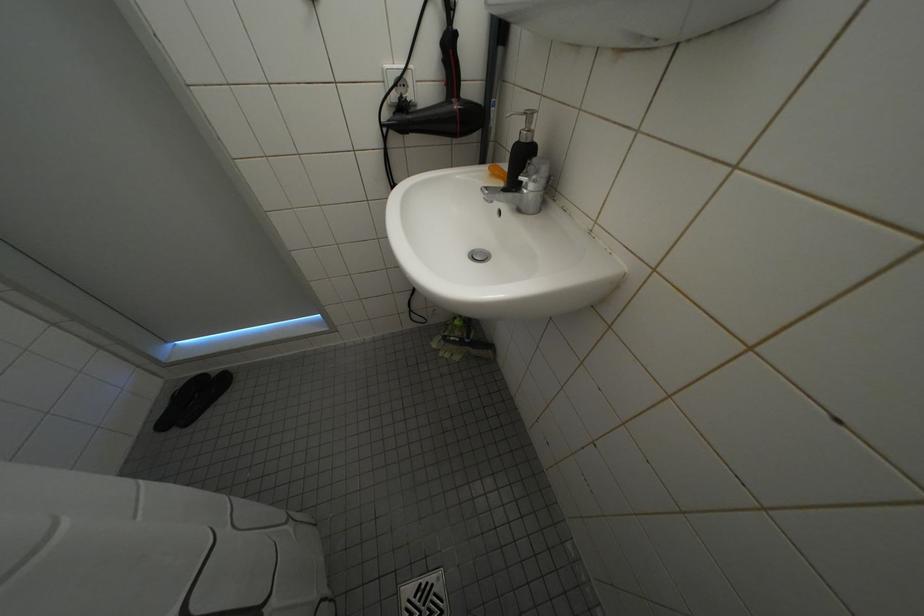
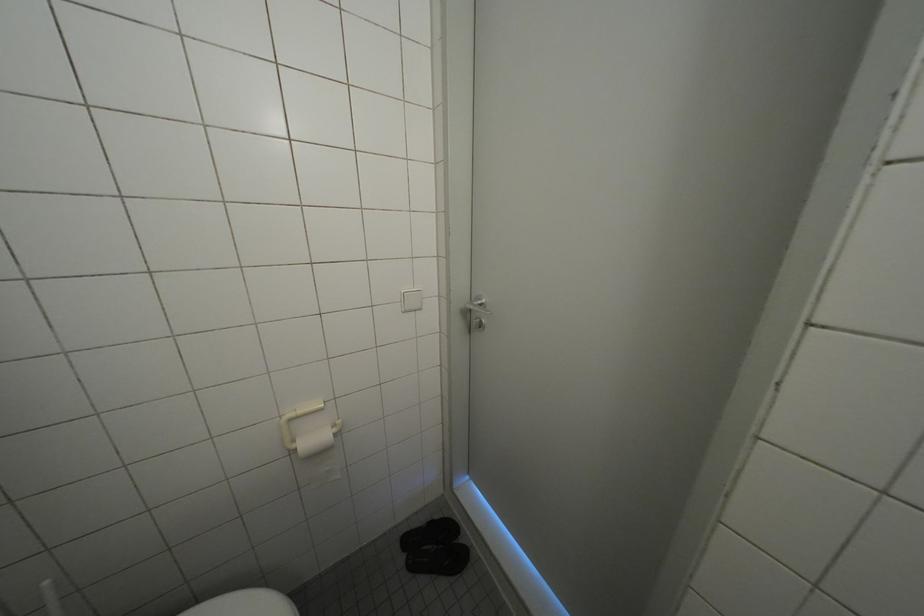
Question: The first image is from the beginning of the video and the second image is from the end. How did the camera likely rotate when shooting the video?

Choices:
 (A) Left
 (B) Right
 (C) Up
 (D) Down

Answer: (A)